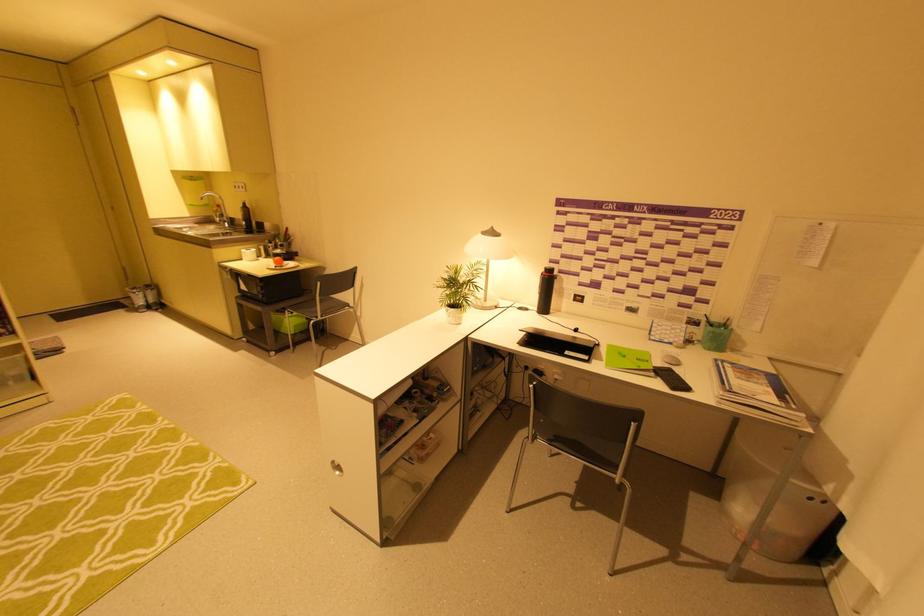
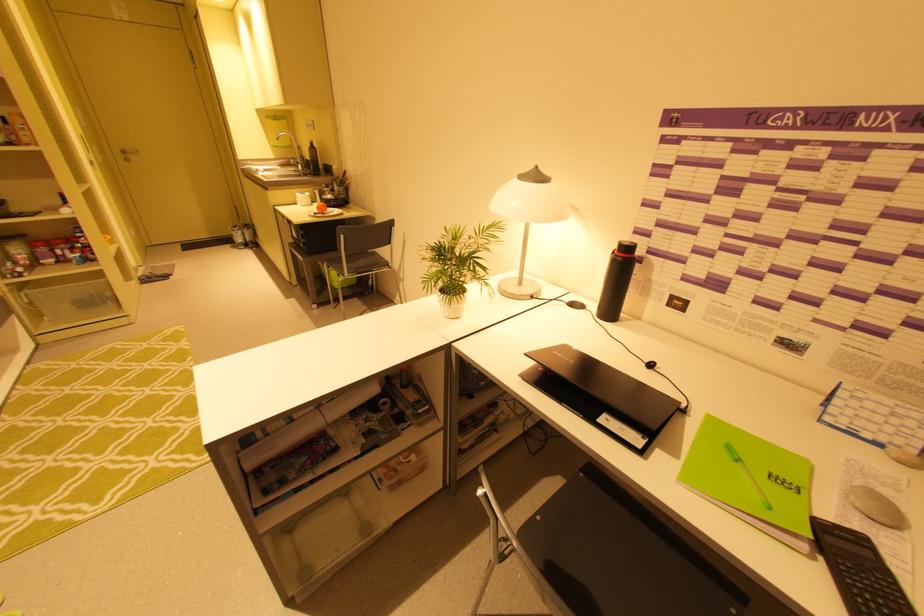
Where in the second image is the point corresponding to pixel 546 270 from the first image?

(619, 248)